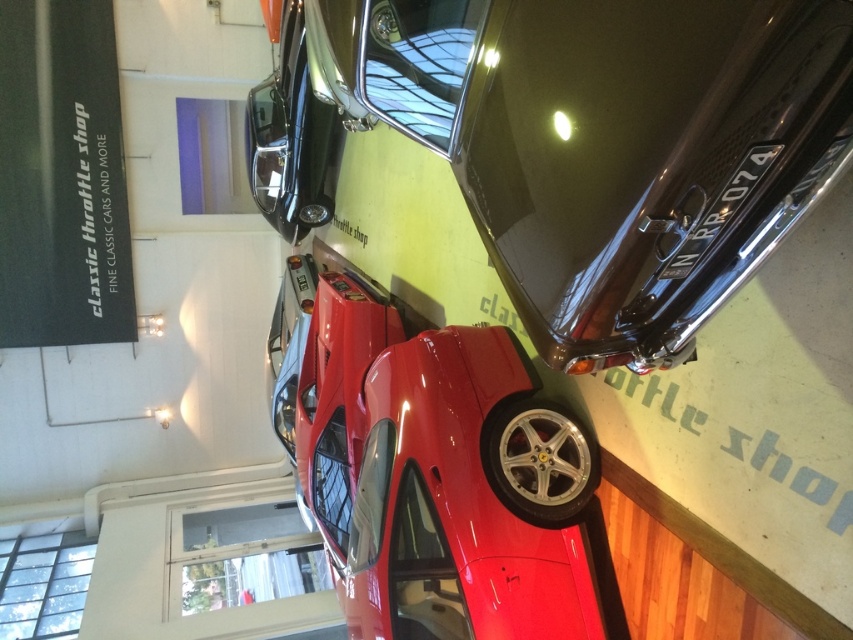
Between shiny black car at upper center and glossy red car at center, which one is positioned lower?

glossy red car at center is below.

Is point (581, 182) less distant than point (585, 502)?

That is True.

What do you see at coordinates (577, 141) in the screenshot? Image resolution: width=853 pixels, height=640 pixels. I see `shiny black car at upper center` at bounding box center [577, 141].

Locate an element on the screen. shiny black car at upper center is located at coordinates (577, 141).